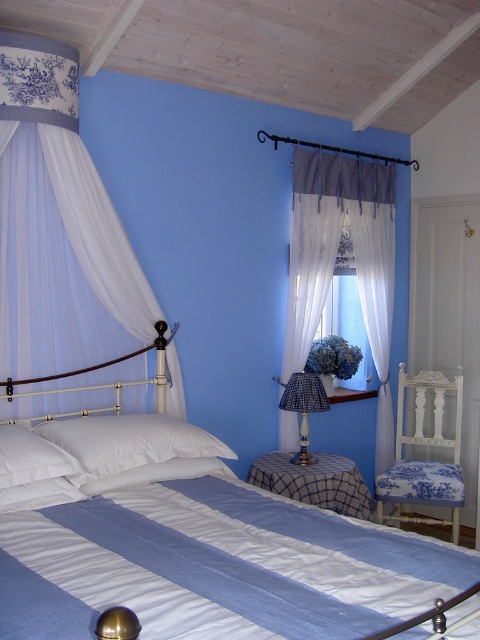
Who is more forward, (238, 531) or (295, 272)?

Point (238, 531)

Who is more forward, (193, 499) or (385, 305)?

Positioned in front is point (193, 499).

Locate an element on the screen. The image size is (480, 640). white cotton bed at center is located at coordinates (199, 548).

Does white soft pillow at lower left have a larger size compared to blue plaid fabric lampshade at center?

Incorrect, white soft pillow at lower left is not larger than blue plaid fabric lampshade at center.

The image size is (480, 640). Describe the element at coordinates (31, 458) in the screenshot. I see `white soft pillow at lower left` at that location.

Find the location of a particular element. white soft pillow at lower left is located at coordinates (31, 458).

Between white soft pillow at center and blue fabric at center, which one is positioned higher?

blue fabric at center

Who is more distant from viewer, (98, 432) or (355, 378)?

The point (355, 378) is behind.

The height and width of the screenshot is (640, 480). Identify the location of white soft pillow at center. (130, 440).